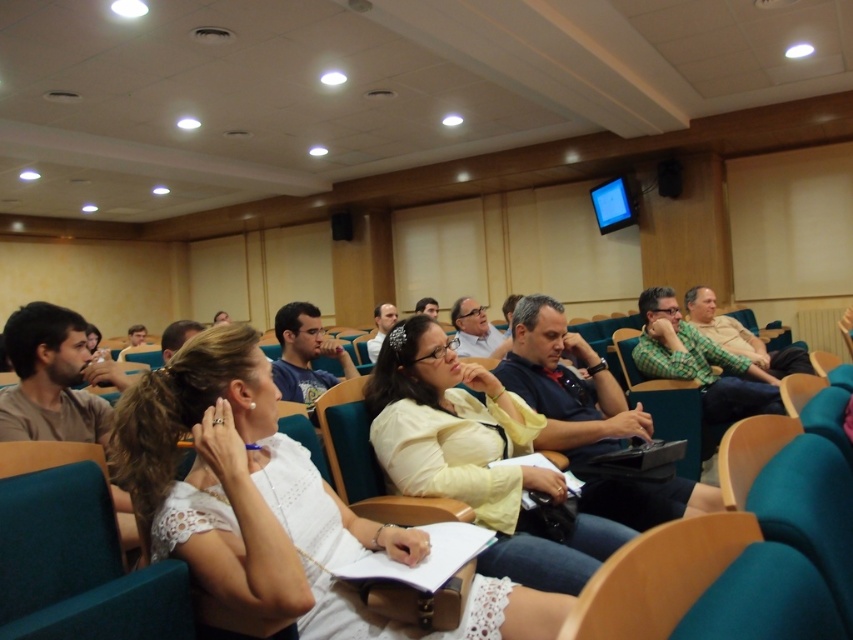
Question: Which point appears farthest from the camera in this image?

Choices:
 (A) (309, 529)
 (B) (544, 548)
 (C) (693, 317)

Answer: (C)

Question: Which of the following is the closest to the observer?

Choices:
 (A) (489, 333)
 (B) (659, 288)
 (C) (585, 342)

Answer: (C)

Question: Is white lace dress at center wider than matte yellow shirt at center?

Choices:
 (A) no
 (B) yes

Answer: (B)

Question: Which is farther from the matte blue shirt at center?

Choices:
 (A) matte black laptop at center
 (B) white lace dress at center
 (C) matte white blouse at center
 (D) matte yellow shirt at center

Answer: (A)

Question: Is matte yellow shirt at center bigger than green checkered shirt at center?

Choices:
 (A) no
 (B) yes

Answer: (B)

Question: Does green checkered shirt at center appear on the left side of green plaid shirt at right?

Choices:
 (A) no
 (B) yes

Answer: (B)